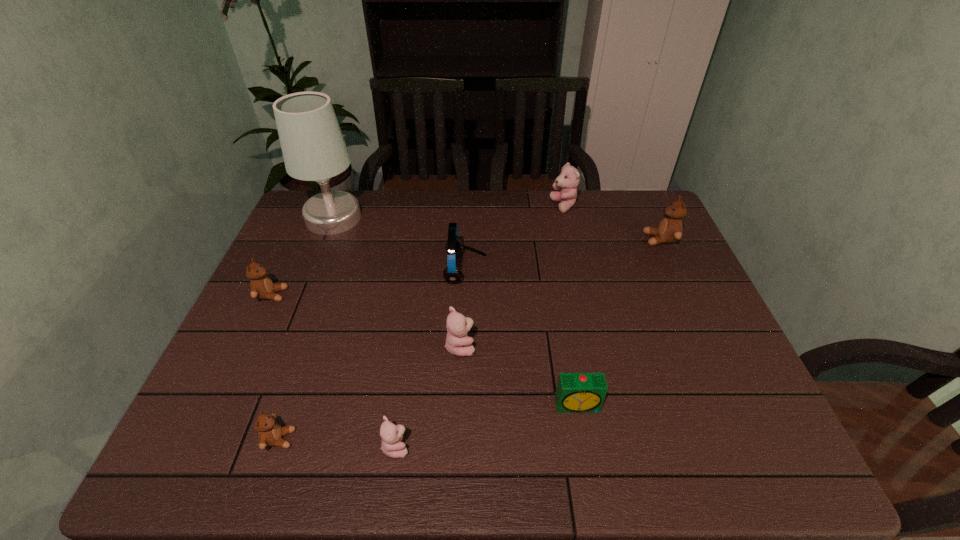
Find the location of a particular element. This screenshot has height=540, width=960. vacant space situated at the face of the biggest pink teddy bear is located at coordinates (536, 206).

Locate an element on the screen. The image size is (960, 540). vacant space located 0.090m on the front-facing side of the second farthest teddy bear is located at coordinates (616, 239).

Where is `free space located on the front-facing side of the second farthest teddy bear`? free space located on the front-facing side of the second farthest teddy bear is located at coordinates (581, 239).

Identify the location of free space located on the front-facing side of the second farthest teddy bear. This screenshot has height=540, width=960. (607, 239).

At what (x,y) coordinates should I click in order to perform the action: click on vacant position located 0.280m with the microphone attached to the side of the red headset. Please return your answer as a coordinate pair (x, y). Looking at the image, I should click on (583, 269).

Where is `vacant space situated 0.210m on the front-facing side of the second smallest brown teddy bear`? Image resolution: width=960 pixels, height=540 pixels. vacant space situated 0.210m on the front-facing side of the second smallest brown teddy bear is located at coordinates (363, 295).

The height and width of the screenshot is (540, 960). In order to click on free space located at the face of the fourth nearest object in this screenshot , I will do `click(528, 346)`.

Where is `free space located 0.070m on the front-facing side of the alarm clock`? free space located 0.070m on the front-facing side of the alarm clock is located at coordinates (585, 445).

Identify the location of vacant region located 0.300m on the front-facing side of the second brown teddy bear from left to right. The height and width of the screenshot is (540, 960). (439, 439).

This screenshot has height=540, width=960. In order to click on free space located 0.250m at the face of the smallest pink teddy bear in this screenshot , I will do `click(532, 446)`.